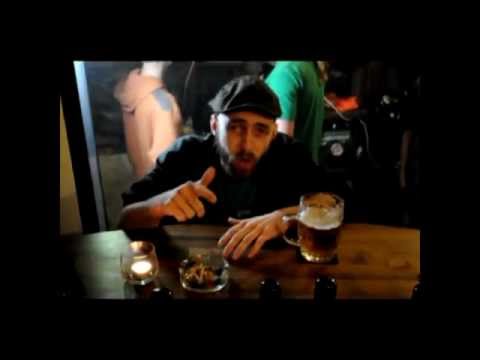
Image resolution: width=480 pixels, height=360 pixels. Find the location of `ash tray`. ash tray is located at coordinates (207, 276).